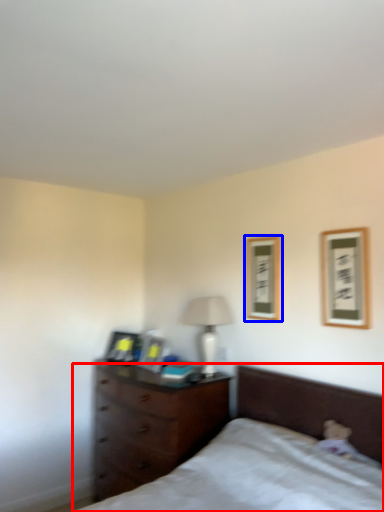
Question: Among these objects, which one is nearest to the camera, bed (highlighted by a red box) or picture frame (highlighted by a blue box)?

Choices:
 (A) bed
 (B) picture frame

Answer: (A)